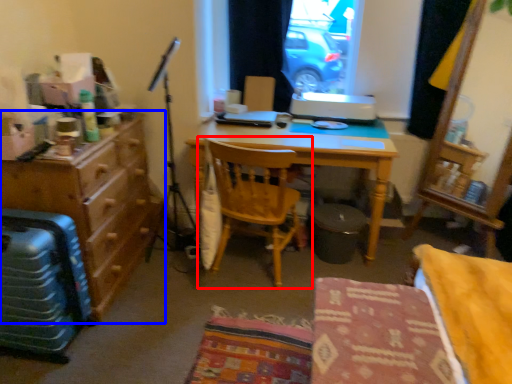
Question: Which object is closer to the camera taking this photo, chair (highlighted by a red box) or cabinetry (highlighted by a blue box)?

Choices:
 (A) chair
 (B) cabinetry

Answer: (B)